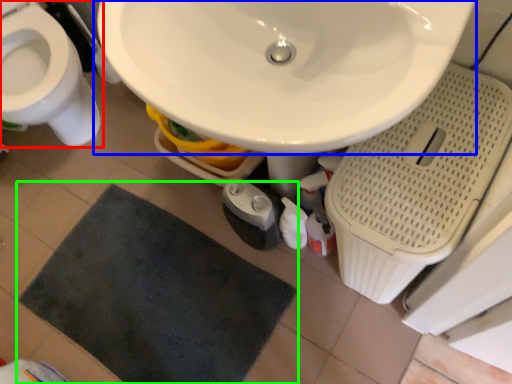
Question: Based on their relative distances, which object is nearer to toilet (highlighted by a red box)? Choose from sink (highlighted by a blue box) and bath mat (highlighted by a green box).

Choices:
 (A) sink
 (B) bath mat

Answer: (B)